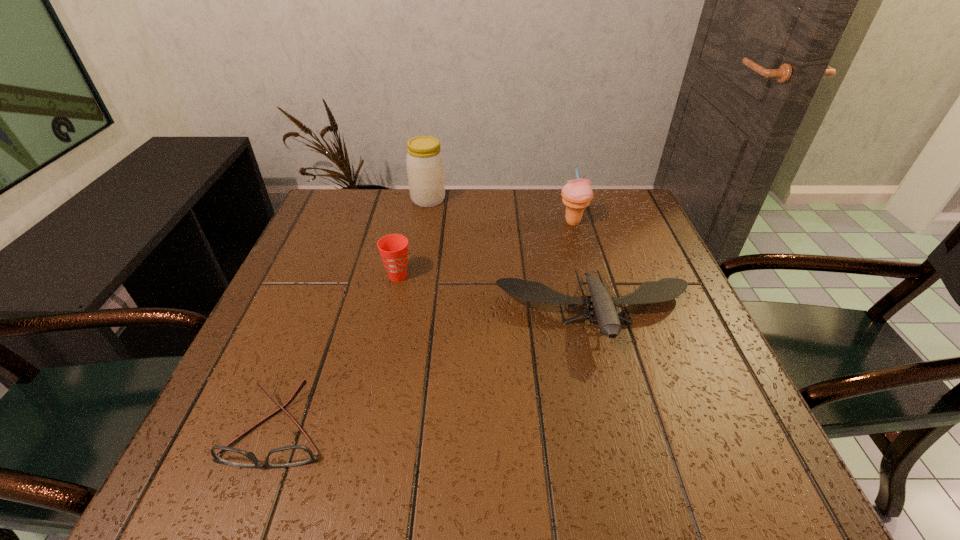
Where is `free location located at the head of the second shortest object`? The image size is (960, 540). free location located at the head of the second shortest object is located at coordinates (627, 430).

You are a GUI agent. You are given a task and a screenshot of the screen. Output one action in this format:
    pyautogui.click(x=<x>, y=<y>)
    Task: Click on the jar at the far edge
    
    Given the screenshot: What is the action you would take?
    pyautogui.click(x=425, y=166)

You are a GUI agent. You are given a task and a screenshot of the screen. Output one action in this format:
    pyautogui.click(x=<x>, y=<y>)
    Task: Click on the icecream situated at the far edge
    
    Given the screenshot: What is the action you would take?
    pyautogui.click(x=577, y=194)

You are a GUI agent. You are given a task and a screenshot of the screen. Output one action in this format:
    pyautogui.click(x=<x>, y=<y>)
    Task: Click on the object that is at the near edge
    
    Given the screenshot: What is the action you would take?
    pyautogui.click(x=295, y=455)

Find the location of a particular element. Image resolution: width=960 pixels, height=540 pixels. object at the left edge is located at coordinates (295, 455).

You are a GUI agent. You are given a task and a screenshot of the screen. Output one action in this format:
    pyautogui.click(x=<x>, y=<y>)
    Task: Click on the icecream at the right edge
    
    Given the screenshot: What is the action you would take?
    pyautogui.click(x=577, y=194)

This screenshot has width=960, height=540. I want to click on drone located in the right edge section of the desktop, so click(665, 289).

Locate an element on the screen. object present at the near left corner is located at coordinates (295, 455).

Where is `object located at the far right corner`? This screenshot has height=540, width=960. object located at the far right corner is located at coordinates (577, 194).

Locate an element on the screen. vacant space at the far edge of the desktop is located at coordinates (377, 212).